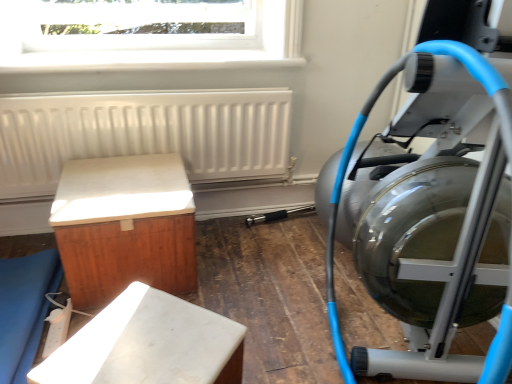
From a real-world perspective, where is a free space above transparent glass window at upper center? Please provide its 2D coordinates.

[(0.231, -0.001)]